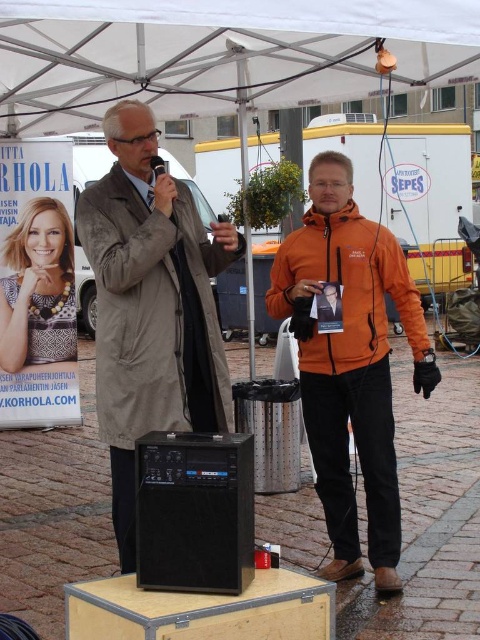
Describe the element at coordinates (217, 54) in the screenshot. Image resolution: width=480 pixels, height=640 pixels. I see `white fabric canopy at upper center` at that location.

Can you confirm if white fabric canopy at upper center is positioned above gray fabric trench coat at upper left?

Yes, white fabric canopy at upper center is above gray fabric trench coat at upper left.

Is point (75, 96) closer to viewer compared to point (219, 259)?

No, it is behind (219, 259).

Locate an element on the screen. white fabric canopy at upper center is located at coordinates (217, 54).

Does gray fabric trench coat at upper left have a lesser width compared to orange fleece jacket at center?

Yes.

Can you confirm if gray fabric trench coat at upper left is taller than orange fleece jacket at center?

Yes.

The image size is (480, 640). Describe the element at coordinates (151, 307) in the screenshot. I see `gray fabric trench coat at upper left` at that location.

This screenshot has width=480, height=640. Find the location of `gray fabric trench coat at upper left`. gray fabric trench coat at upper left is located at coordinates (151, 307).

Is white fabric canopy at upper center to the left of orange fleece jacket at center from the viewer's perspective?

Yes, white fabric canopy at upper center is to the left of orange fleece jacket at center.

Is point (48, 68) behind point (309, 257)?

Yes, point (48, 68) is behind point (309, 257).

This screenshot has height=640, width=480. What do you see at coordinates (217, 54) in the screenshot? I see `white fabric canopy at upper center` at bounding box center [217, 54].

At what (x,y) coordinates should I click in order to perform the action: click on white fabric canopy at upper center. Please return your answer as a coordinate pair (x, y). This screenshot has width=480, height=640. Looking at the image, I should click on (217, 54).